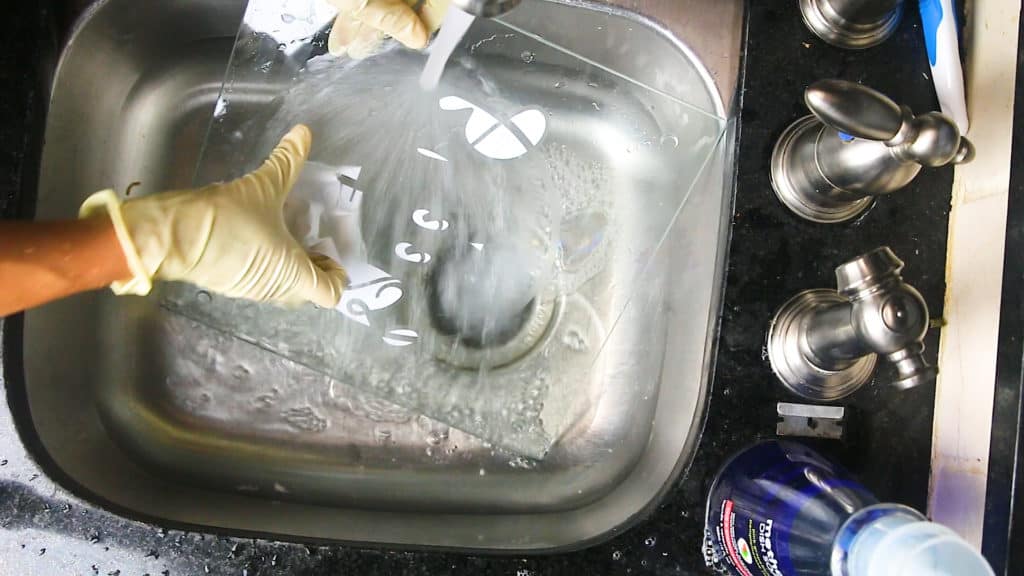
You are a GUI agent. You are given a task and a screenshot of the screen. Output one action in this format:
    pyautogui.click(x=<x>, y=<y>)
    Task: Click on the metal sink
    This screenshot has width=1024, height=576.
    Given the screenshot: What is the action you would take?
    pyautogui.click(x=73, y=382)